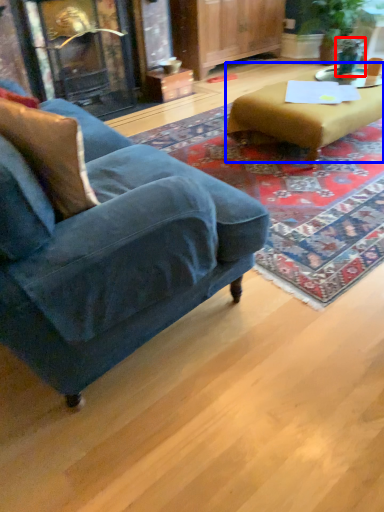
Question: Which object is closer to the camera taking this photo, teal (highlighted by a red box) or table (highlighted by a blue box)?

Choices:
 (A) teal
 (B) table

Answer: (B)